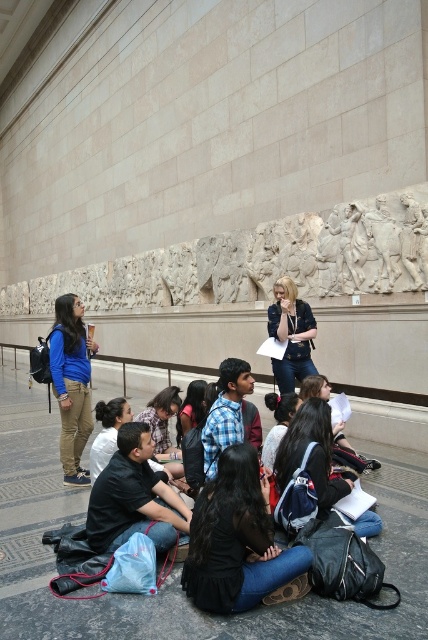
Can you confirm if matte blue shirt at lower left is thinner than white marble relief at upper center?

No, matte blue shirt at lower left is not thinner than white marble relief at upper center.

Is matte blue shirt at lower left to the right of white marble relief at upper center from the viewer's perspective?

In fact, matte blue shirt at lower left is to the left of white marble relief at upper center.

Between point (95, 342) and point (356, 230), which one is positioned in front?

Positioned in front is point (356, 230).

I want to click on matte blue shirt at lower left, so 71,384.